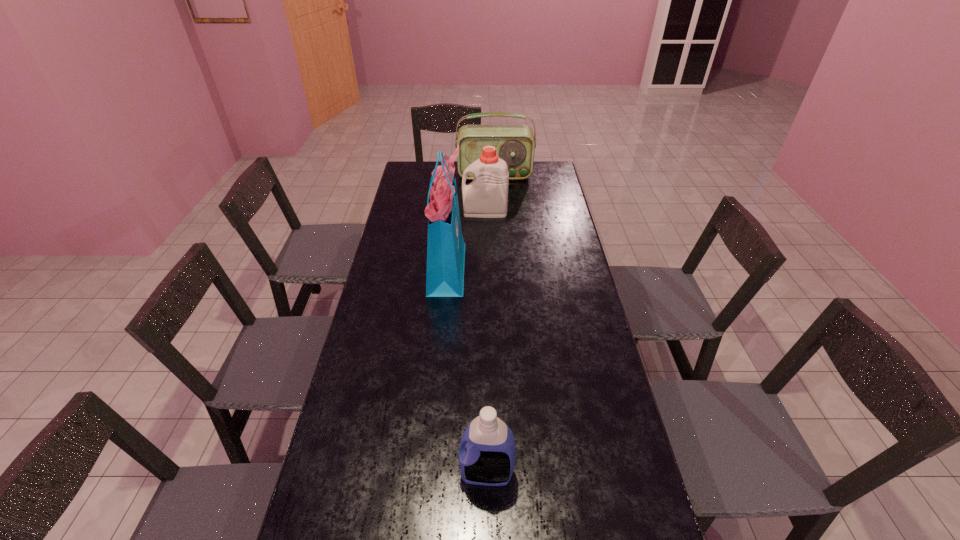
You are a GUI agent. You are given a task and a screenshot of the screen. Output one action in this format:
    pyautogui.click(x=<x>, y=<y>)
    Task: Click on the vacant point located between the farther detergent and the shopping bag
    This screenshot has height=540, width=960.
    Given the screenshot: What is the action you would take?
    pyautogui.click(x=466, y=239)

I want to click on free spot between the third nearest object and the nearest object, so click(x=486, y=342).

Where is `the second closest object to the farther detergent`? The width and height of the screenshot is (960, 540). the second closest object to the farther detergent is located at coordinates (515, 144).

Identify which object is the nearest to the tallest object. Please provide its 2D coordinates. Your answer should be formatted as a tuple, i.e. [(x, y)], where the tuple contains the x and y coordinates of a point satisfying the conditions above.

[(486, 196)]